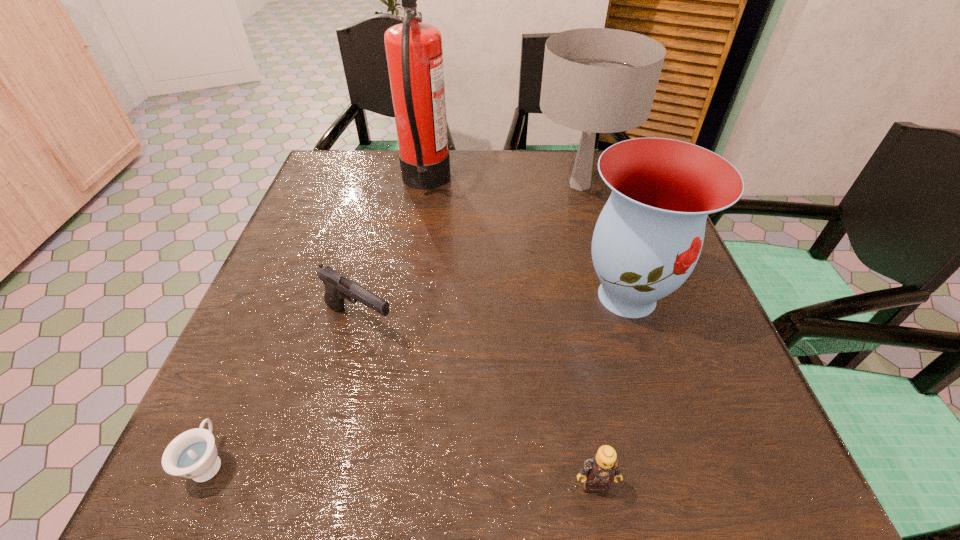
Where is `vacant space that's between the fourth shortest object and the leftmost object`? The height and width of the screenshot is (540, 960). vacant space that's between the fourth shortest object and the leftmost object is located at coordinates (419, 379).

You are a GUI agent. You are given a task and a screenshot of the screen. Output one action in this format:
    pyautogui.click(x=<x>, y=<y>)
    Task: Click on the free space between the gun and the Lego
    The height and width of the screenshot is (540, 960).
    Given the screenshot: What is the action you would take?
    pyautogui.click(x=477, y=403)

Where is `free spot between the fourth shortest object and the tallest object`? free spot between the fourth shortest object and the tallest object is located at coordinates coord(526,239).

In order to click on vacant space that's between the teacup and the gun in this screenshot , I will do `click(284, 392)`.

This screenshot has width=960, height=540. Find the location of `vacant space that's between the Lego and the vase`. vacant space that's between the Lego and the vase is located at coordinates (611, 389).

Identify the location of vacant area that lies between the gun and the fire extinguisher. This screenshot has height=540, width=960. (393, 253).

Where is `free spot between the Lego and the vase`? The image size is (960, 540). free spot between the Lego and the vase is located at coordinates (611, 389).

Find the location of `free space that is in between the fifth shortest object and the Lego`. free space that is in between the fifth shortest object and the Lego is located at coordinates (587, 334).

What are the coordinates of `free space between the teacup and the tallest object` in the screenshot? It's located at (318, 322).

Where is `free space between the Lego and the tallest object`? free space between the Lego and the tallest object is located at coordinates point(510,333).